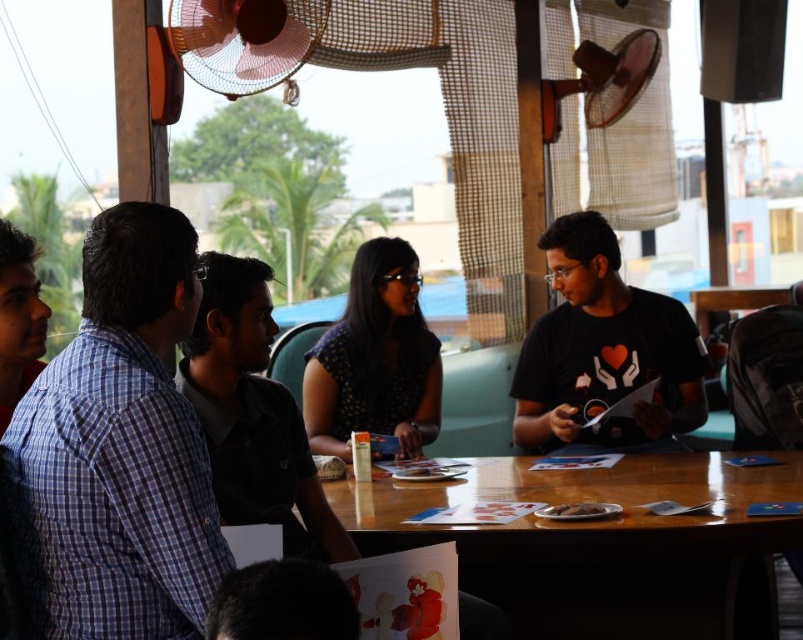
You are taking a photo of the scene and want to focus on both point (331, 509) and point (422, 349). Which point should you adjust your focus to first to ensure both are in focus?

Point (331, 509) is closer to the camera than point (422, 349), so you should focus on point (331, 509) first to ensure both are in focus.

You are a photographer standing in front of the scene. You want to take a photo that includes both the point at (x=602, y=298) and the point at (x=198, y=3). Which point will appear closer to the camera in the final photo?

Point (x=602, y=298) is further to the viewer than point (x=198, y=3), so in the photo, the point at (x=198, y=3) will appear closer to the camera.

You are a photographer setting up a shoot in this scene. You need to ensure that all subjects are visible in the frame. Given that the black matte shirt at center and the dark blue dotted dress at center are both at the center, which one might need to be adjusted to ensure visibility?

The black matte shirt at center has a lesser height compared to dark blue dotted dress at center, so the dark blue dotted dress at center might need to be adjusted to ensure visibility since it is taller and could block the view of the shorter subject.